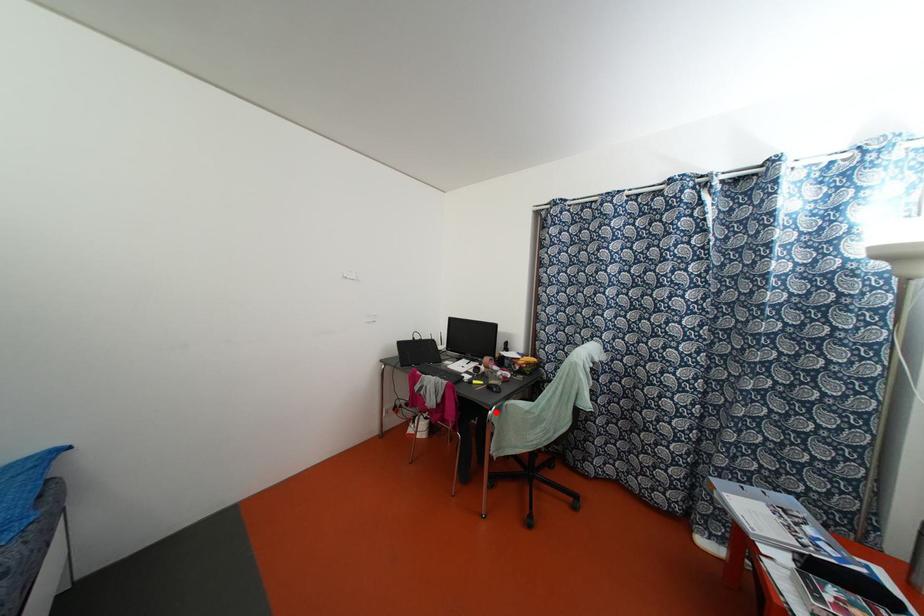
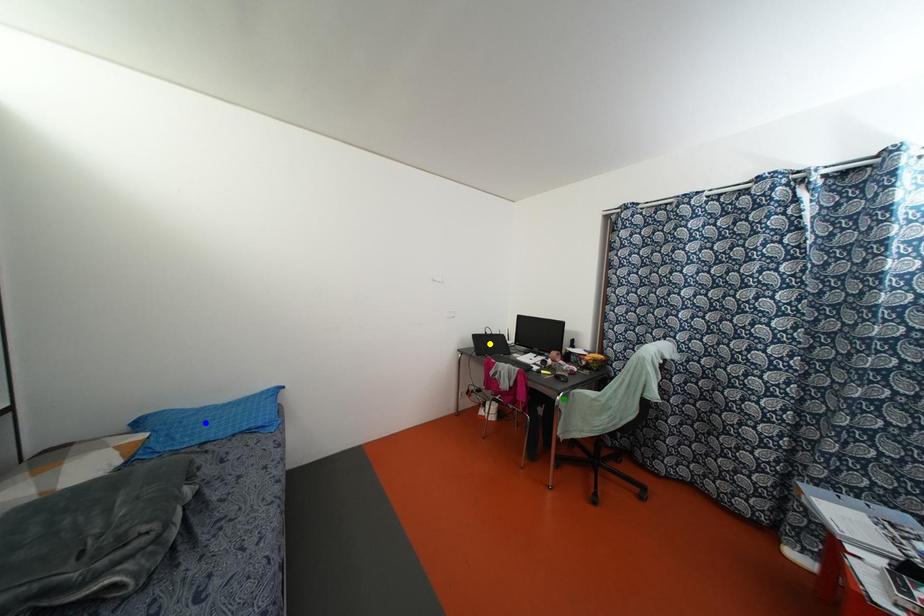
Question: I am providing you with two images of the same scene from different viewpoints. A red point is marked on the first image. You are given multiple points on the second image. Can you choose the point in image 2 that corresponds to the point in image 1?

Choices:
 (A) blue point
 (B) green point
 (C) yellow point

Answer: (B)